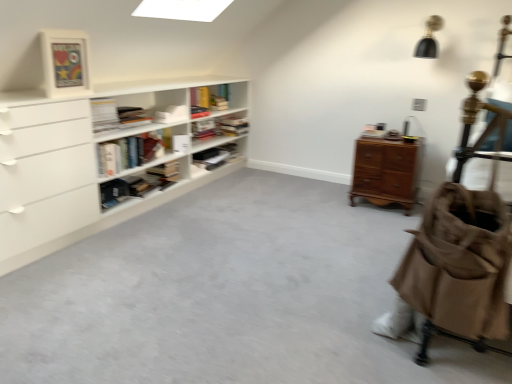
Question: In terms of height, does white matte bookshelf at center, placed as the 4th book when sorted from bottom to top, look taller or shorter compared to hardcover book at center, the 1th book when ordered from bottom to top?

Choices:
 (A) tall
 (B) short

Answer: (B)

Question: From a real-world perspective, is white matte bookshelf at center, marked as the first book in a top-to-bottom arrangement, above or below hardcover book at center, the fourth book from the top?

Choices:
 (A) above
 (B) below

Answer: (A)

Question: Which of these objects is positioned farthest from the white matte bookshelf at center, marked as the first book in a top-to-bottom arrangement?

Choices:
 (A) matte black bookshelf at center, acting as the 2th shelf starting from the back
 (B) light brown wooden chest of drawers at right
 (C) brown canvas stroller at right
 (D) white matte bookshelf at left, the 1th shelf viewed from the front
 (E) hardcover book at upper left, which is the 2th book from bottom to top

Answer: (C)

Question: Which is nearer to the hardcover book at upper left, which is the 2th book from bottom to top?

Choices:
 (A) light brown wooden chest of drawers at right
 (B) wooden bookshelf at upper center, placed as the 3th shelf when sorted from front to back
 (C) brown canvas stroller at right
 (D) white matte bookshelf at left, which appears as the third shelf when viewed from the back
 (E) hardcover book at center, the 1th book when ordered from bottom to top

Answer: (D)